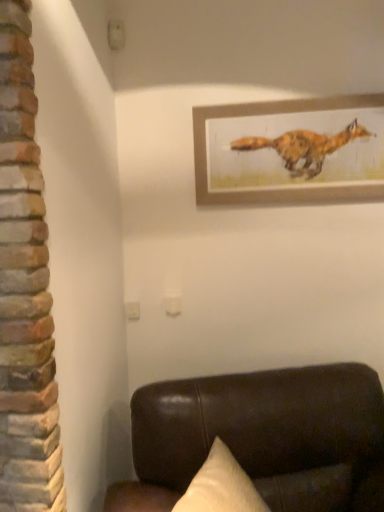
Image resolution: width=384 pixels, height=512 pixels. Describe the element at coordinates (263, 438) in the screenshot. I see `brown leather couch at lower right` at that location.

What is the approximate width of brown leather couch at lower right?

brown leather couch at lower right is 38.28 inches wide.

At what (x,y) coordinates should I click in order to perform the action: click on brown leather couch at lower right. Please return your answer as a coordinate pair (x, y). Looking at the image, I should click on (263, 438).

What do you see at coordinates (290, 151) in the screenshot?
I see `wooden framed fox painting at upper center` at bounding box center [290, 151].

Where is `wooden framed fox painting at upper center`? The height and width of the screenshot is (512, 384). wooden framed fox painting at upper center is located at coordinates (290, 151).

The height and width of the screenshot is (512, 384). What are the coordinates of `brown leather couch at lower right` in the screenshot? It's located at [x=263, y=438].

Is brown leather couch at lower right at the right side of wooden framed fox painting at upper center?

In fact, brown leather couch at lower right is to the left of wooden framed fox painting at upper center.

Which is behind, brown leather couch at lower right or wooden framed fox painting at upper center?

wooden framed fox painting at upper center is behind.

Is point (281, 508) farther from viewer compared to point (342, 146)?

No, (281, 508) is closer to viewer.

From the image's perspective, who appears lower, brown leather couch at lower right or wooden framed fox painting at upper center?

brown leather couch at lower right.

From a real-world perspective, relative to wooden framed fox painting at upper center, is brown leather couch at lower right vertically above or below?

In terms of real-world spatial position, brown leather couch at lower right is below wooden framed fox painting at upper center.

In terms of width, does brown leather couch at lower right look wider or thinner when compared to wooden framed fox painting at upper center?

brown leather couch at lower right is wider than wooden framed fox painting at upper center.

Who is shorter, brown leather couch at lower right or wooden framed fox painting at upper center?

Standing shorter between the two is wooden framed fox painting at upper center.

Can you confirm if brown leather couch at lower right is bigger than wooden framed fox painting at upper center?

Indeed, brown leather couch at lower right has a larger size compared to wooden framed fox painting at upper center.

Is brown leather couch at lower right not within wooden framed fox painting at upper center?

Absolutely, brown leather couch at lower right is external to wooden framed fox painting at upper center.

Is brown leather couch at lower right far from wooden framed fox painting at upper center?

No, brown leather couch at lower right is not far away from wooden framed fox painting at upper center.

Is brown leather couch at lower right aimed at wooden framed fox painting at upper center?

No, brown leather couch at lower right is not oriented towards wooden framed fox painting at upper center.

In the image, there is a brown leather couch at lower right. Identify the location of picture frame above it (from the image's perspective). (290, 151).

Is wooden framed fox painting at upper center to the right of brown leather couch at lower right from the viewer's perspective?

Indeed, wooden framed fox painting at upper center is positioned on the right side of brown leather couch at lower right.

Does wooden framed fox painting at upper center come in front of brown leather couch at lower right?

No, wooden framed fox painting at upper center is behind brown leather couch at lower right.

Considering the positions of points (234, 199) and (269, 389), is point (234, 199) farther from camera compared to point (269, 389)?

Yes, it is.

From the image's perspective, which is below, wooden framed fox painting at upper center or brown leather couch at lower right?

brown leather couch at lower right is shown below in the image.

From a real-world perspective, relative to brown leather couch at lower right, is wooden framed fox painting at upper center vertically above or below?

Clearly, from a real-world perspective, wooden framed fox painting at upper center is above brown leather couch at lower right.

Which object is thinner, wooden framed fox painting at upper center or brown leather couch at lower right?

With smaller width is wooden framed fox painting at upper center.

Based on the photo, in terms of height, does wooden framed fox painting at upper center look taller or shorter compared to brown leather couch at lower right?

Considering their sizes, wooden framed fox painting at upper center has less height than brown leather couch at lower right.

Considering the relative sizes of wooden framed fox painting at upper center and brown leather couch at lower right in the image provided, is wooden framed fox painting at upper center bigger than brown leather couch at lower right?

No.

Is wooden framed fox painting at upper center surrounding brown leather couch at lower right?

No, brown leather couch at lower right is not a part of wooden framed fox painting at upper center.

Does wooden framed fox painting at upper center touch brown leather couch at lower right?

No, wooden framed fox painting at upper center is not beside brown leather couch at lower right.

Is wooden framed fox painting at upper center facing away from brown leather couch at lower right?

No, wooden framed fox painting at upper center is not facing the opposite direction of brown leather couch at lower right.

Looking at this image, can you tell me how much wooden framed fox painting at upper center and brown leather couch at lower right differ in facing direction?

The facing directions of wooden framed fox painting at upper center and brown leather couch at lower right are 15.5 degrees apart.

Measure the distance from wooden framed fox painting at upper center to brown leather couch at lower right.

wooden framed fox painting at upper center and brown leather couch at lower right are 37.86 inches apart.

You are a GUI agent. You are given a task and a screenshot of the screen. Output one action in this format:
    pyautogui.click(x=<x>, y=<y>)
    Task: Click on the picture frame above the brown leather couch at lower right (from a real-world perspective)
    This screenshot has height=512, width=384.
    Given the screenshot: What is the action you would take?
    pyautogui.click(x=290, y=151)

You are a GUI agent. You are given a task and a screenshot of the screen. Output one action in this format:
    pyautogui.click(x=<x>, y=<y>)
    Task: Click on the furniture that is below the wooden framed fox painting at upper center (from the image's perspective)
    The width and height of the screenshot is (384, 512).
    Given the screenshot: What is the action you would take?
    pyautogui.click(x=263, y=438)

The width and height of the screenshot is (384, 512). I want to click on picture frame that appears above the brown leather couch at lower right (from the image's perspective), so click(290, 151).